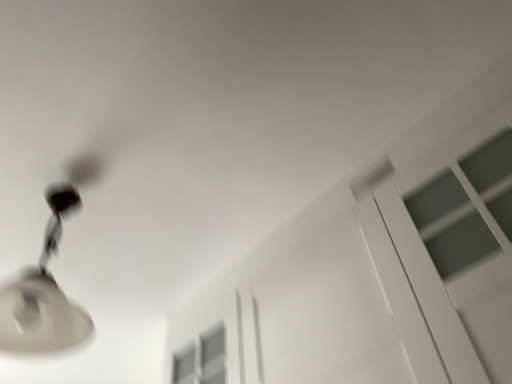
The height and width of the screenshot is (384, 512). In order to click on white glossy lamp at upper left in this screenshot , I will do `click(47, 283)`.

What do you see at coordinates (47, 283) in the screenshot? The width and height of the screenshot is (512, 384). I see `white glossy lamp at upper left` at bounding box center [47, 283].

Measure the distance between point (69, 306) and camera.

Point (69, 306) and camera are 3.38 feet apart from each other.

Identify the location of white glossy lamp at upper left. The image size is (512, 384). (47, 283).